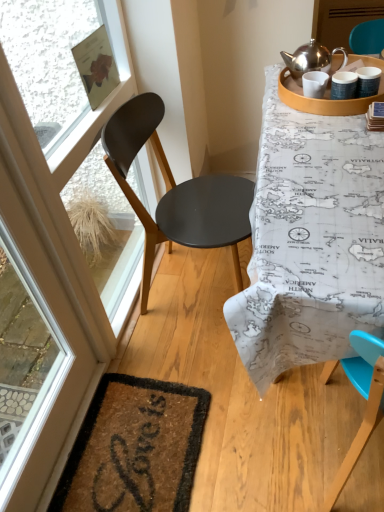
Question: Is transparent glass screen door at left, positioned as the 1th screen door in left-to-right order, inside or outside of map-patterned tablecloth at upper right?

Choices:
 (A) inside
 (B) outside

Answer: (B)

Question: Relative to map-patterned tablecloth at upper right, is transparent glass screen door at left, acting as the 2th screen door starting from the top, in front or behind?

Choices:
 (A) front
 (B) behind

Answer: (A)

Question: Estimate the real-world distances between objects in this image. Which object is closer to the transparent glass window screen at upper left?

Choices:
 (A) brown coir mat at lower left
 (B) transparent glass screen door at left, the second screen door positioned from the back
 (C) matte brown screen door at upper right, placed as the second screen door when sorted from bottom to top
 (D) matte wooden tray at upper right
 (E) matte black chair at left

Answer: (E)

Question: Which object is positioned closest to the transparent glass screen door at left, which is the first screen door in bottom-to-top order?

Choices:
 (A) matte brown screen door at upper right, placed as the first screen door when sorted from top to bottom
 (B) matte black chair at left
 (C) transparent glass window screen at upper left
 (D) brown coir mat at lower left
 (E) matte wooden tray at upper right

Answer: (B)